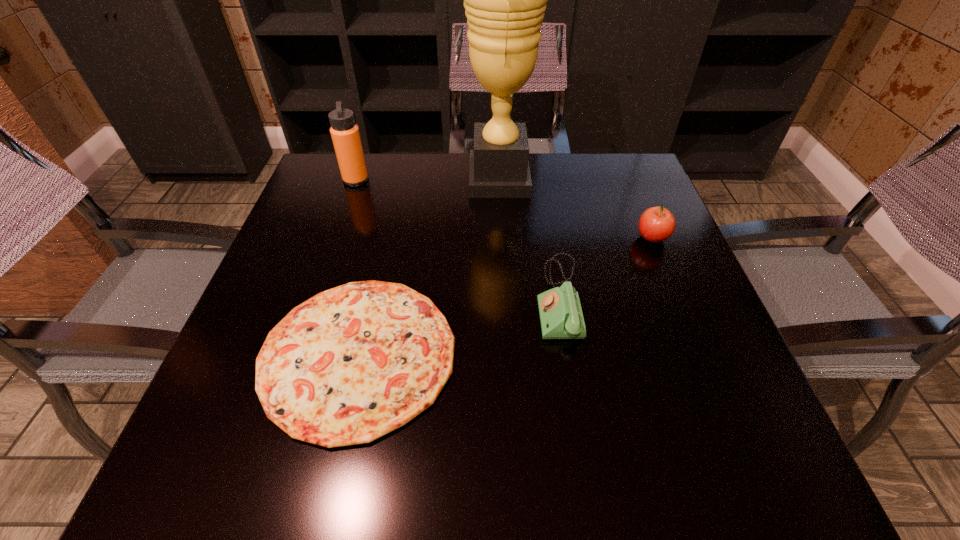
Find the location of `blank region between the fourth shortest object and the third nearest object`. blank region between the fourth shortest object and the third nearest object is located at coordinates (504, 209).

Where is `unoccupied position between the fourth shortest object and the telephone`? unoccupied position between the fourth shortest object and the telephone is located at coordinates (457, 240).

Image resolution: width=960 pixels, height=540 pixels. I want to click on vacant area that lies between the pizza and the tallest object, so click(x=428, y=267).

Where is `free space that is in between the tallest object and the third nearest object`? The height and width of the screenshot is (540, 960). free space that is in between the tallest object and the third nearest object is located at coordinates (576, 208).

The width and height of the screenshot is (960, 540). I want to click on vacant area that lies between the thermos bottle and the fourth tallest object, so click(x=457, y=240).

Identify the location of free space between the shortest object and the trophy cup. (428, 267).

The width and height of the screenshot is (960, 540). What are the coordinates of `blank region between the trophy cup and the shortest object` in the screenshot? It's located at 428,267.

Find the location of a particular element. Image resolution: width=960 pixels, height=540 pixels. unoccupied area between the tallest object and the thermos bottle is located at coordinates (427, 180).

Find the location of `unoccupied position between the third shortest object and the trophy cup`. unoccupied position between the third shortest object and the trophy cup is located at coordinates (576, 208).

At what (x,y) coordinates should I click in order to perform the action: click on vacant area that lies between the trophy cup and the third farthest object. Please return your answer as a coordinate pair (x, y). The width and height of the screenshot is (960, 540). Looking at the image, I should click on (576, 208).